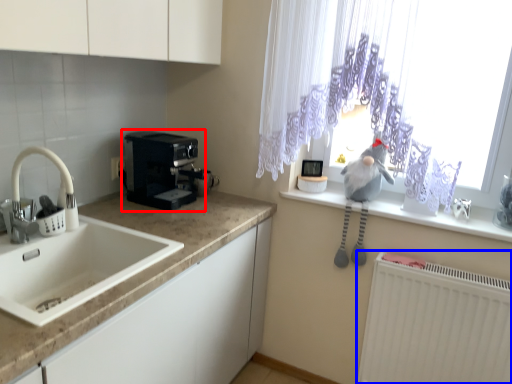
Question: Which object is closer to the camera taking this photo, coffee maker (highlighted by a red box) or radiator (highlighted by a blue box)?

Choices:
 (A) coffee maker
 (B) radiator

Answer: (B)